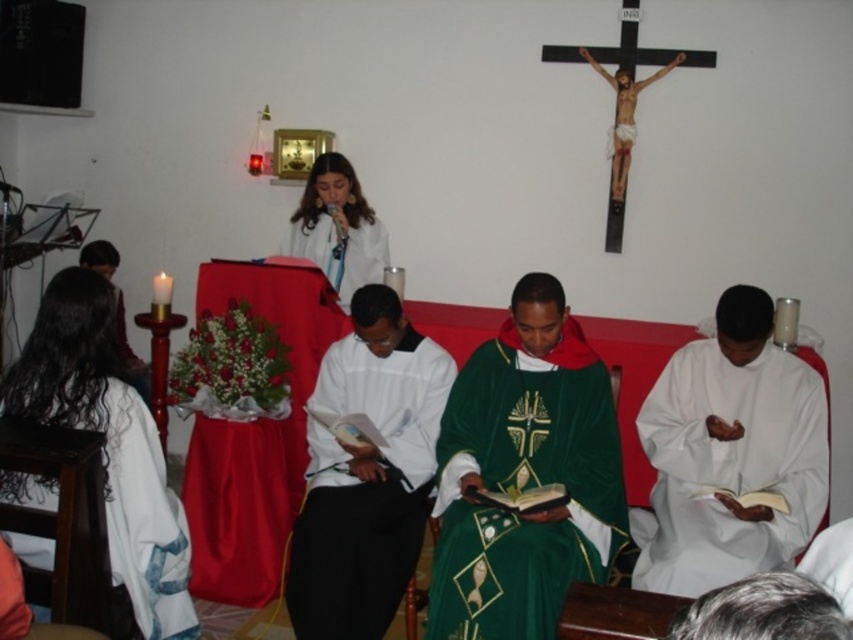
You are a photographer standing in front of the altar. You want to capture a photo of both the green velvet robe at center and the white matte robe at center in the same frame. Given that your camera has a minimum focus distance of 16 inches, will you be able to take the photo without moving closer?

The green velvet robe at center and white matte robe at center are 15.55 inches apart from each other, which is less than the camera minimum focus distance of 16 inches. Therefore, you can take the photo without moving closer.

You are an assistant at the church and need to determine which robe requires more fabric to make between the white matte robe at lower right and the white matte robe at upper center. Based on the image, which one would you choose?

The white matte robe at lower right requires more fabric because its width is larger than the white matte robe at upper center.